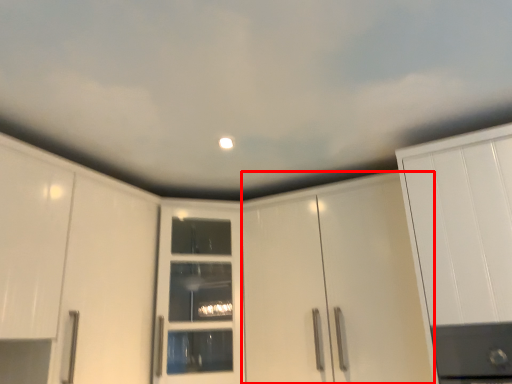
Question: Where is cabinetry (annotated by the red box) located in relation to door in the image?

Choices:
 (A) left
 (B) right

Answer: (B)